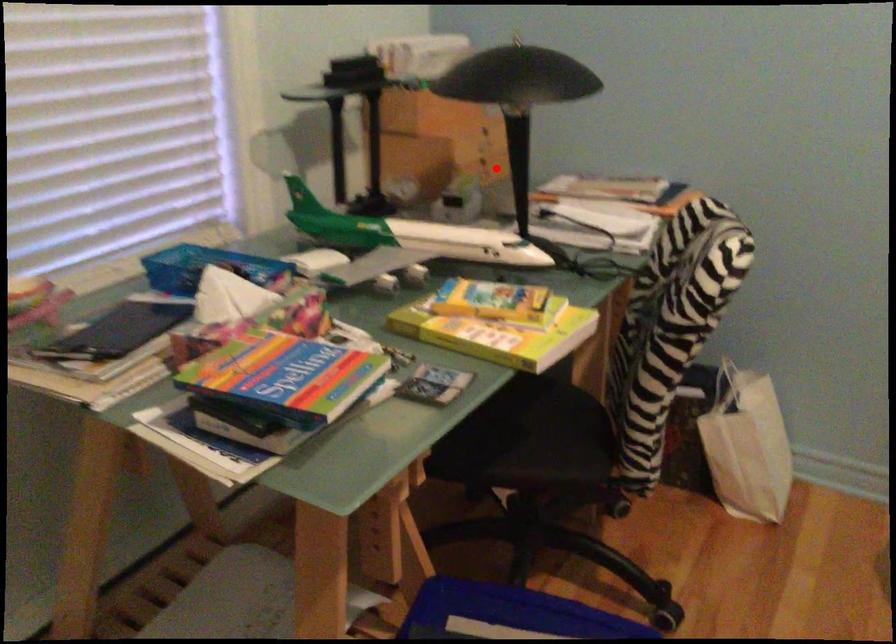
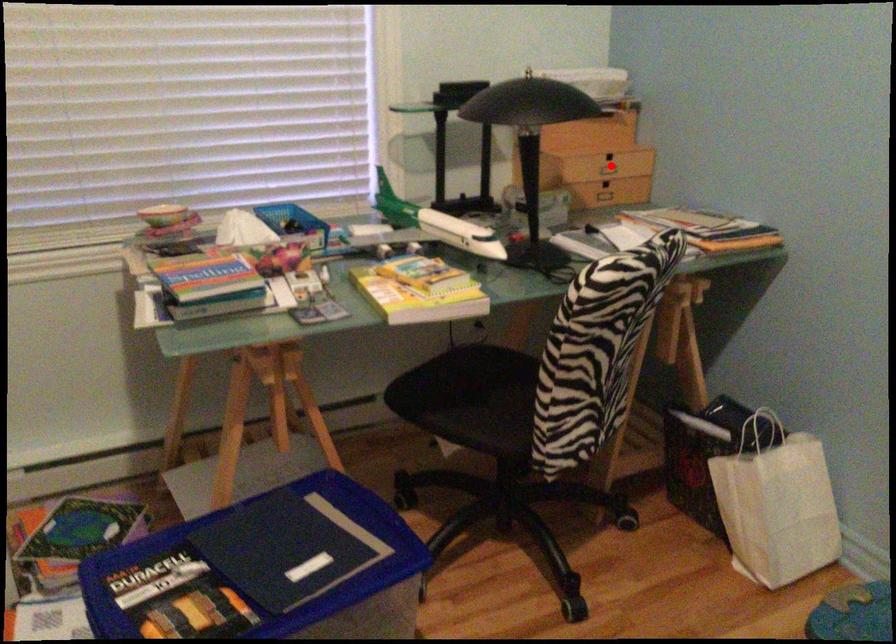
I am providing you with two images of the same scene from different viewpoints. A red point is marked on the first image and another point is marked on the second image. Is the red point in image1 aligned with the point shown in image2?

No